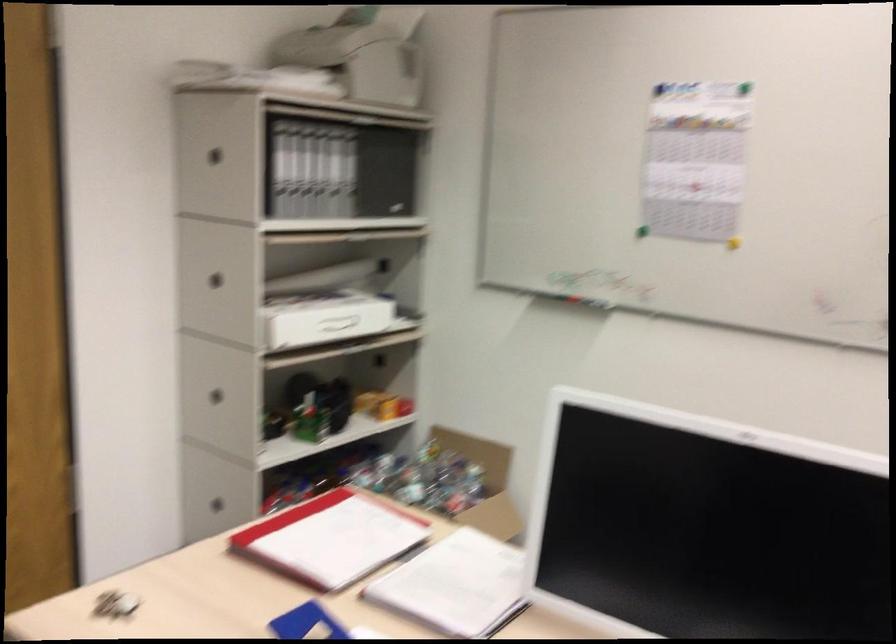
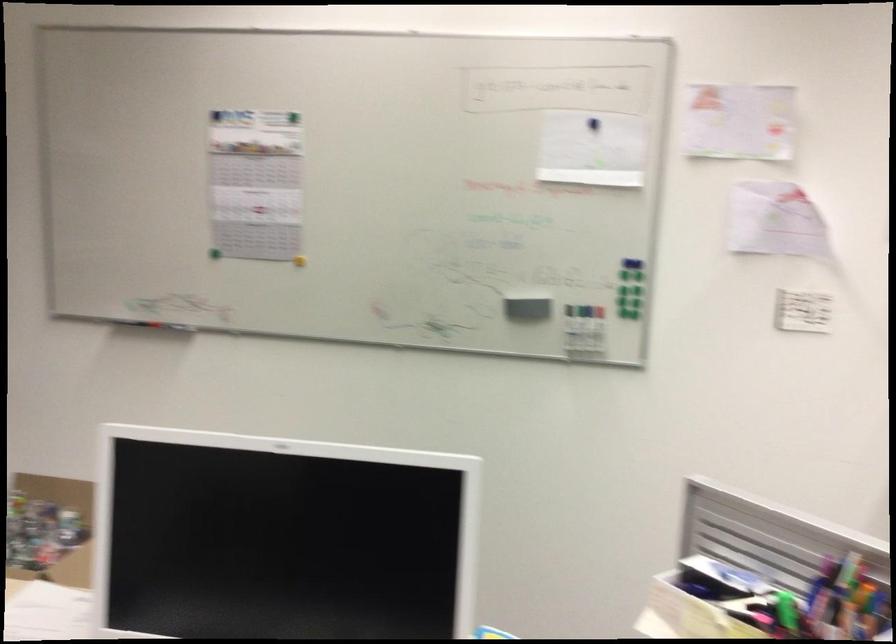
In the second image, find the point that corresponds to the point at 570,297 in the first image.

(158, 325)